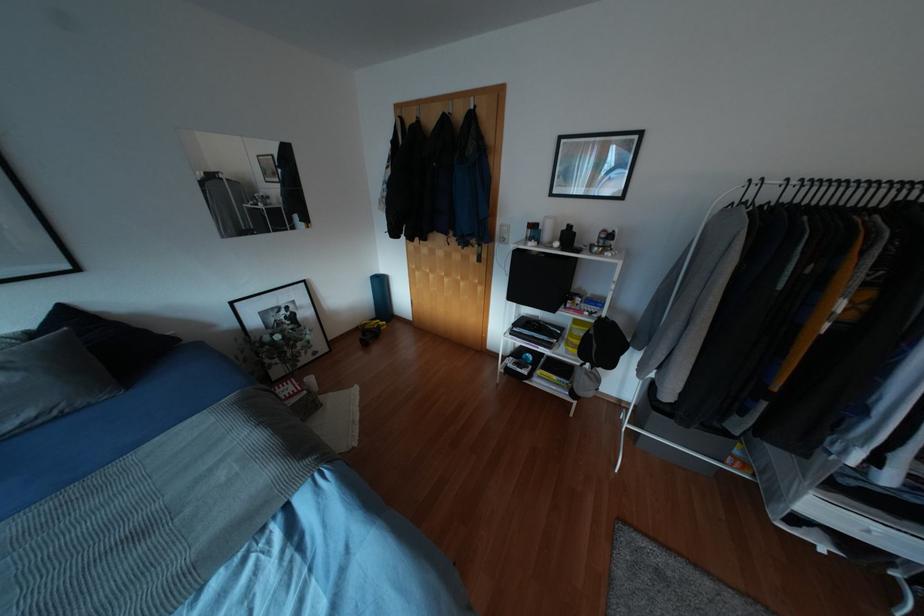
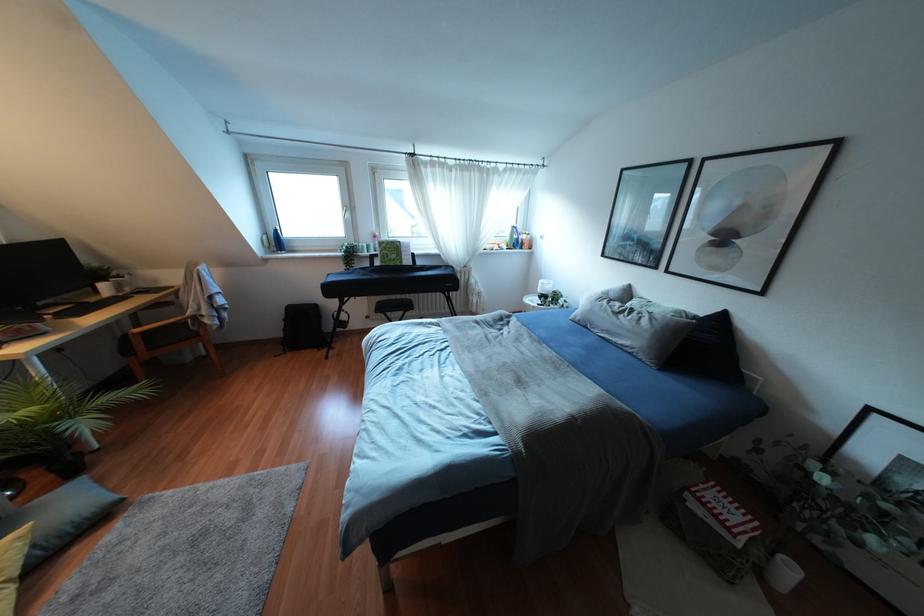
Find the pixel in the second image that matches (66,313) in the first image.

(722, 317)